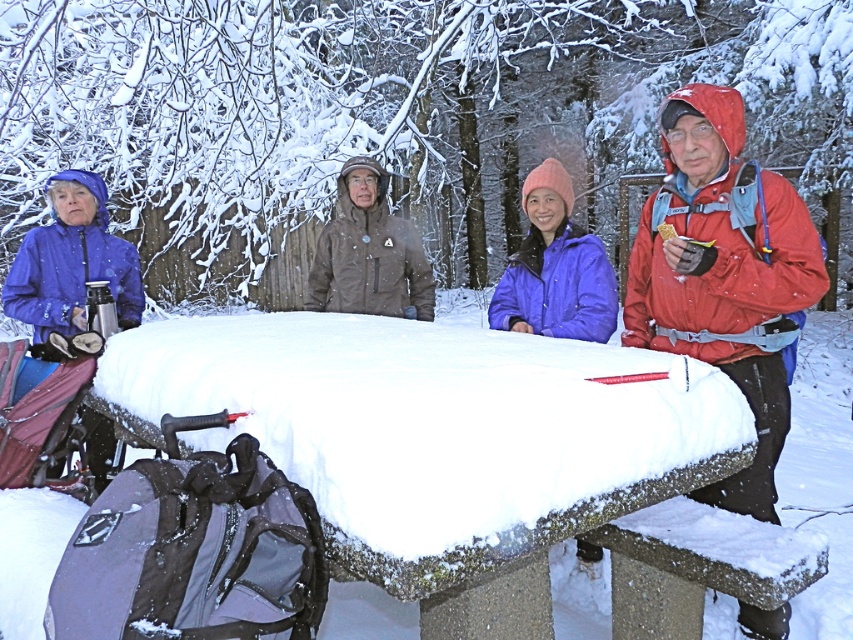
Question: Among these points, which one is farthest from the camera?

Choices:
 (A) (743, 452)
 (B) (581, 266)
 (C) (788, 365)
 (D) (335, 296)

Answer: (D)

Question: Which point appears farthest from the camera in this image?

Choices:
 (A) (634, 426)
 (B) (711, 312)
 (C) (68, 289)
 (D) (380, 208)

Answer: (D)

Question: Is matte blue jacket at center to the left of brown softshell jacket at center from the viewer's perspective?

Choices:
 (A) yes
 (B) no

Answer: (B)

Question: Does red matte jacket at upper right have a lesser width compared to matte blue jacket at center?

Choices:
 (A) yes
 (B) no

Answer: (B)

Question: Can you confirm if matte blue jacket at left is wider than matte blue jacket at center?

Choices:
 (A) no
 (B) yes

Answer: (B)

Question: Which point is closer to the camera?

Choices:
 (A) (67, 285)
 (B) (737, 456)

Answer: (B)